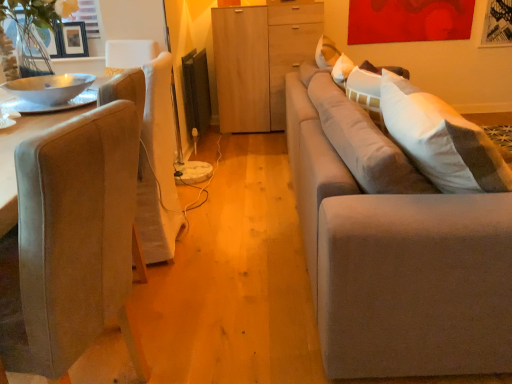
Question: From the image's perspective, would you say suede gray couch at right is shown under light wood cabinet at center?

Choices:
 (A) yes
 (B) no

Answer: (A)

Question: Is suede gray couch at right facing towards light wood cabinet at center?

Choices:
 (A) no
 (B) yes

Answer: (A)

Question: Is suede gray couch at right oriented away from light wood cabinet at center?

Choices:
 (A) no
 (B) yes

Answer: (A)

Question: Is suede gray couch at right positioned beyond the bounds of light wood cabinet at center?

Choices:
 (A) no
 (B) yes

Answer: (B)

Question: Considering the relative sizes of suede gray couch at right and light wood cabinet at center in the image provided, is suede gray couch at right shorter than light wood cabinet at center?

Choices:
 (A) no
 (B) yes

Answer: (B)

Question: Are suede gray couch at right and light wood cabinet at center located far from each other?

Choices:
 (A) no
 (B) yes

Answer: (B)

Question: Considering the relative sizes of suede-like beige chair at left and light wood cabinet at center in the image provided, is suede-like beige chair at left bigger than light wood cabinet at center?

Choices:
 (A) yes
 (B) no

Answer: (B)

Question: From a real-world perspective, is suede-like beige chair at left physically below light wood cabinet at center?

Choices:
 (A) no
 (B) yes

Answer: (B)

Question: From the image's perspective, is suede-like beige chair at left over light wood cabinet at center?

Choices:
 (A) no
 (B) yes

Answer: (A)

Question: Does suede-like beige chair at left have a lesser height compared to light wood cabinet at center?

Choices:
 (A) no
 (B) yes

Answer: (B)

Question: Is suede-like beige chair at left wider than light wood cabinet at center?

Choices:
 (A) no
 (B) yes

Answer: (B)

Question: Is suede-like beige chair at left positioned beyond the bounds of light wood cabinet at center?

Choices:
 (A) yes
 (B) no

Answer: (A)

Question: Can you confirm if white glossy bowl at left is wider than suede gray couch at right?

Choices:
 (A) yes
 (B) no

Answer: (B)